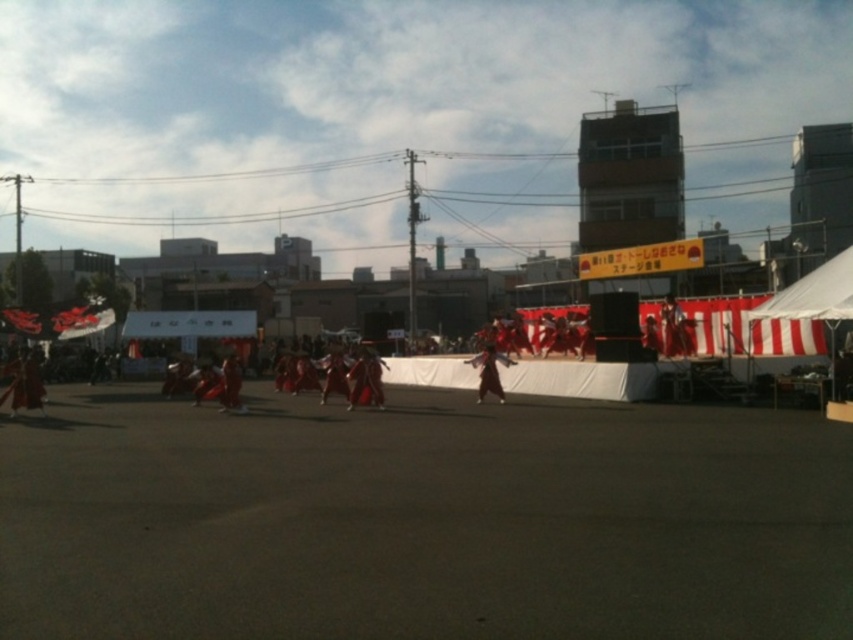
Question: Is red satin kimono at center wider than red silk kimono at center?

Choices:
 (A) no
 (B) yes

Answer: (A)

Question: Among these points, which one is farthest from the camera?

Choices:
 (A) (485, 376)
 (B) (675, 308)
 (C) (219, 381)

Answer: (B)

Question: Is red satin kimono at center smaller than red silk kimono at center?

Choices:
 (A) yes
 (B) no

Answer: (A)

Question: Which point is farther to the camera?

Choices:
 (A) (477, 401)
 (B) (229, 404)

Answer: (A)

Question: Does matte red kimono at center have a smaller size compared to red silk kimono at center?

Choices:
 (A) no
 (B) yes

Answer: (B)

Question: Which point appears farthest from the camera in this image?

Choices:
 (A) (660, 308)
 (B) (236, 403)

Answer: (A)